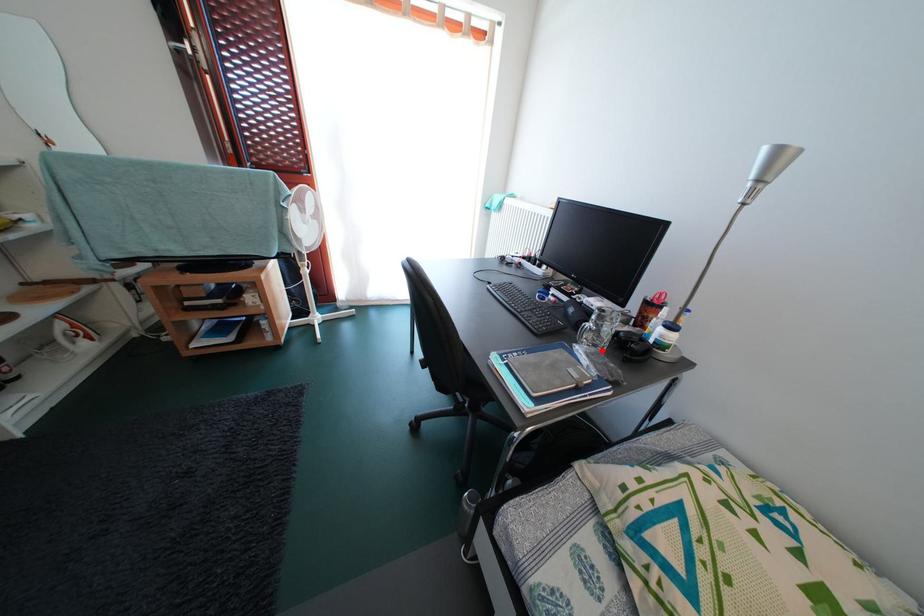
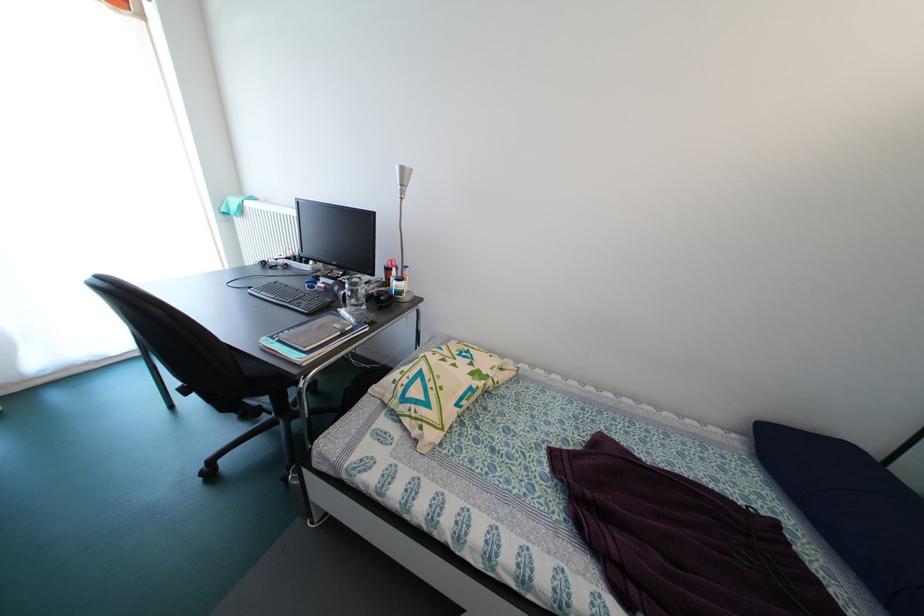
The point at the highlighted location is marked in the first image. Where is the corresponding point in the second image?

(362, 310)